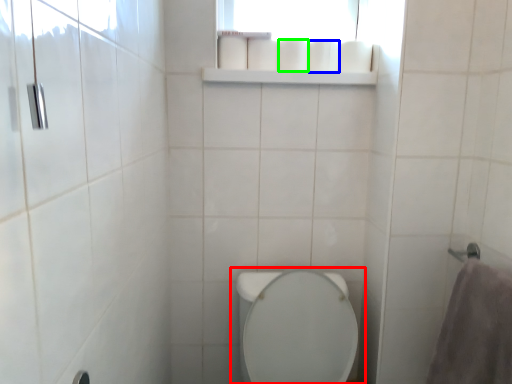
Question: Estimate the real-world distances between objects in this image. Which object is closer to toilet (highlighted by a red box), toilet paper (highlighted by a blue box) or toilet paper (highlighted by a green box)?

Choices:
 (A) toilet paper
 (B) toilet paper

Answer: (B)